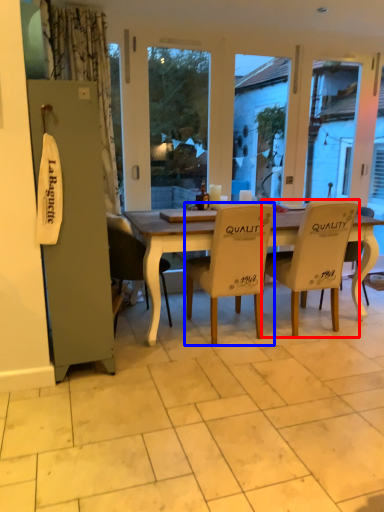
Question: Which object is closer to the camera taking this photo, chair (highlighted by a red box) or chair (highlighted by a blue box)?

Choices:
 (A) chair
 (B) chair

Answer: (B)